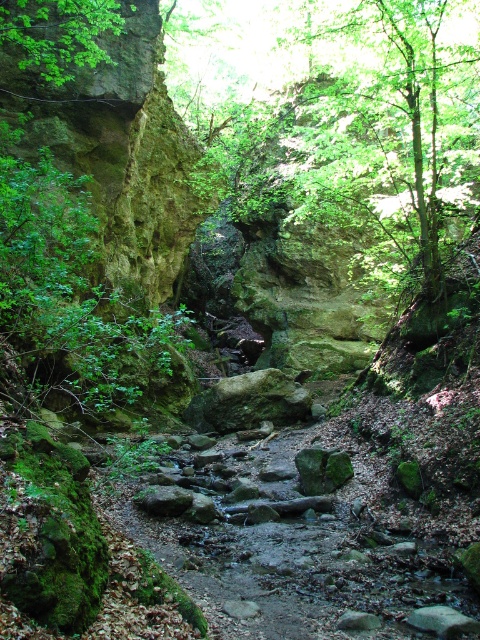
You are hiking through this narrow canyon and want to take a photo of both the green leafy tree at center and the green leafy tree at upper left. Which tree should you move closer to in order to capture both in the same frame?

You should move closer to the green leafy tree at upper left because the green leafy tree at center is closer to you, so moving towards the farther tree will help include both in the frame.

You are a hiker who wants to take a photo of both the green leafy tree at center and the green leafy tree at upper left. Which tree should you stand closer to in order to capture both in a single frame?

You should stand closer to the green leafy tree at upper left because it is shorter than the green leafy tree at center, allowing both to fit within the camera frame when positioned appropriately.